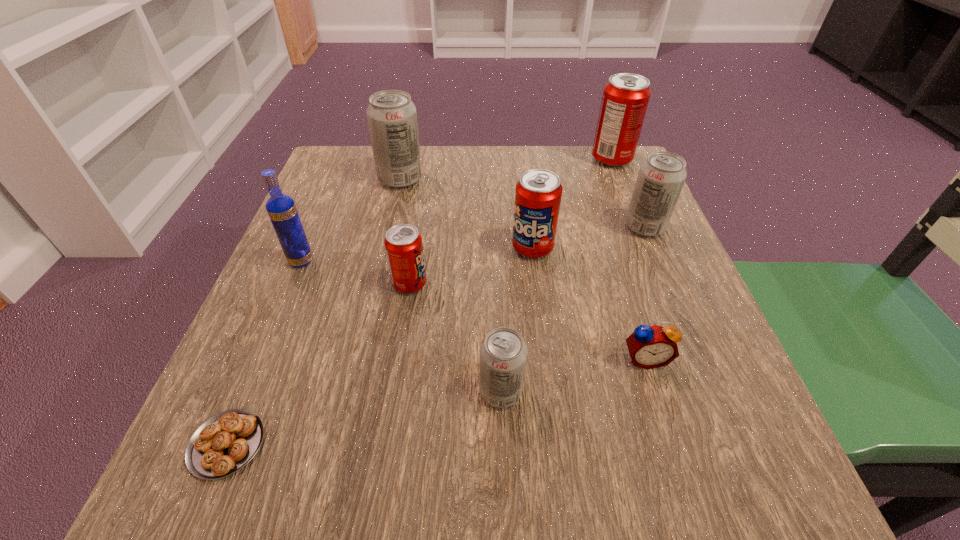
Find the location of a particular element. The height and width of the screenshot is (540, 960). unoccupied position between the pastry and the rightmost gray soda can is located at coordinates (436, 335).

Find the location of a particular element. empty location between the biggest gray soda can and the pastry is located at coordinates (314, 312).

Where is `free space that is in between the leftmost red soda can and the blue vodka`? free space that is in between the leftmost red soda can and the blue vodka is located at coordinates (355, 273).

At what (x,y) coordinates should I click in order to perform the action: click on vacant space in between the fifth object from left to right and the vodka. Please return your answer as a coordinate pair (x, y). This screenshot has width=960, height=540. Looking at the image, I should click on (401, 326).

You are a GUI agent. You are given a task and a screenshot of the screen. Output one action in this format:
    pyautogui.click(x=<x>, y=<y>)
    Task: Click on the empty location between the farthest red soda can and the biggest gray soda can
    
    Given the screenshot: What is the action you would take?
    pyautogui.click(x=506, y=169)

Locate an element on the screen. This screenshot has height=540, width=960. object that is the fifth nearest to the rightmost gray soda can is located at coordinates (403, 243).

You are a GUI agent. You are given a task and a screenshot of the screen. Output one action in this format:
    pyautogui.click(x=<x>, y=<y>)
    Task: Click on the object that ranks as the fourth closest to the second nearest red soda can
    
    Given the screenshot: What is the action you would take?
    pyautogui.click(x=503, y=353)

The width and height of the screenshot is (960, 540). In order to click on soda can that is the third closest one to the shortest object in this screenshot , I will do `click(538, 194)`.

Select which soda can appears as the closest to the seventh farthest object. Please provide its 2D coordinates. Your answer should be formatted as a tuple, i.e. [(x, y)], where the tuple contains the x and y coordinates of a point satisfying the conditions above.

[(503, 353)]

The width and height of the screenshot is (960, 540). What are the coordinates of `red soda can that is the closest one to the farthest red soda can` in the screenshot? It's located at pyautogui.click(x=538, y=194).